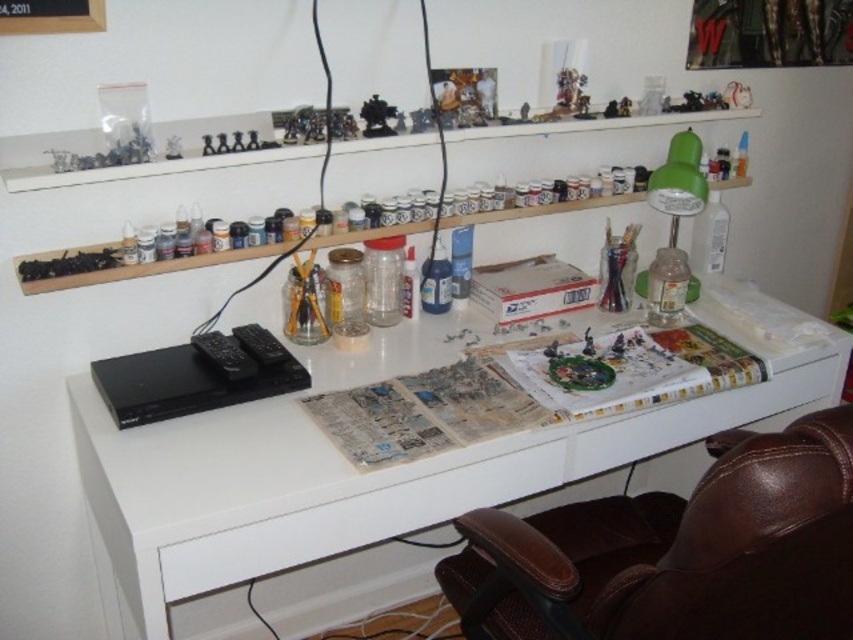
Does white matte computer desk at center come behind brown leather swivel chair at lower right?

Yes, it is.

Looking at this image, does white matte computer desk at center appear on the right side of brown leather swivel chair at lower right?

Incorrect, white matte computer desk at center is not on the right side of brown leather swivel chair at lower right.

Describe the element at coordinates (350, 477) in the screenshot. The image size is (853, 640). I see `white matte computer desk at center` at that location.

Identify the location of white matte computer desk at center. (350, 477).